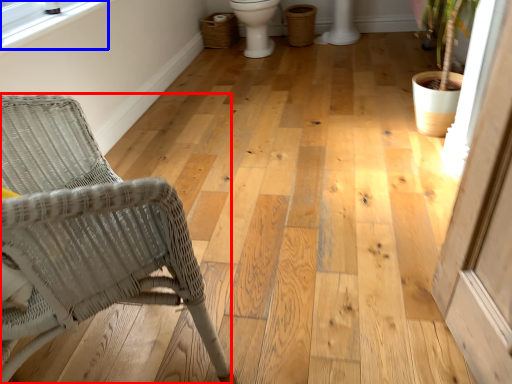
Question: Which of the following is the closest to the observer, chair (highlighted by a red box) or window screen (highlighted by a blue box)?

Choices:
 (A) chair
 (B) window screen

Answer: (A)